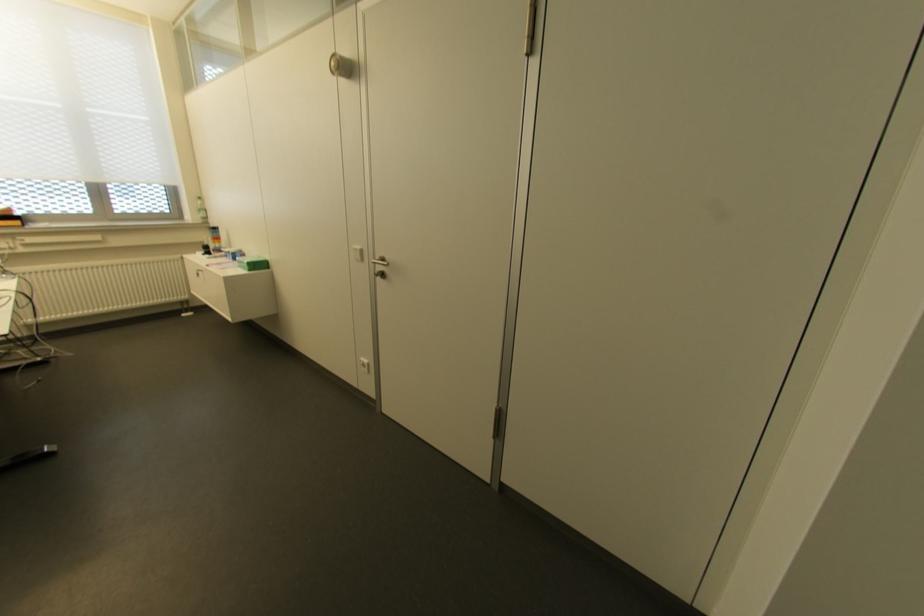
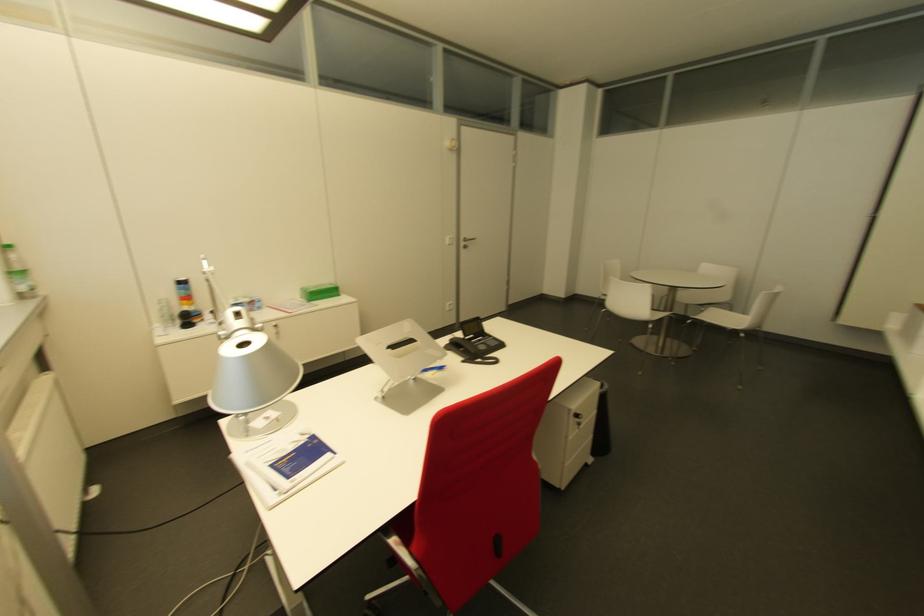
Locate, in the second image, the point that corresponds to point 200,216 in the first image.

(27, 284)